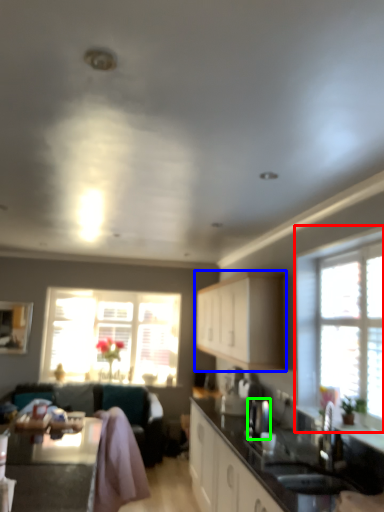
Question: Which is nearer to the window (highlighted by a red box)? cabinetry (highlighted by a blue box) or appliance (highlighted by a green box).

Choices:
 (A) cabinetry
 (B) appliance

Answer: (B)